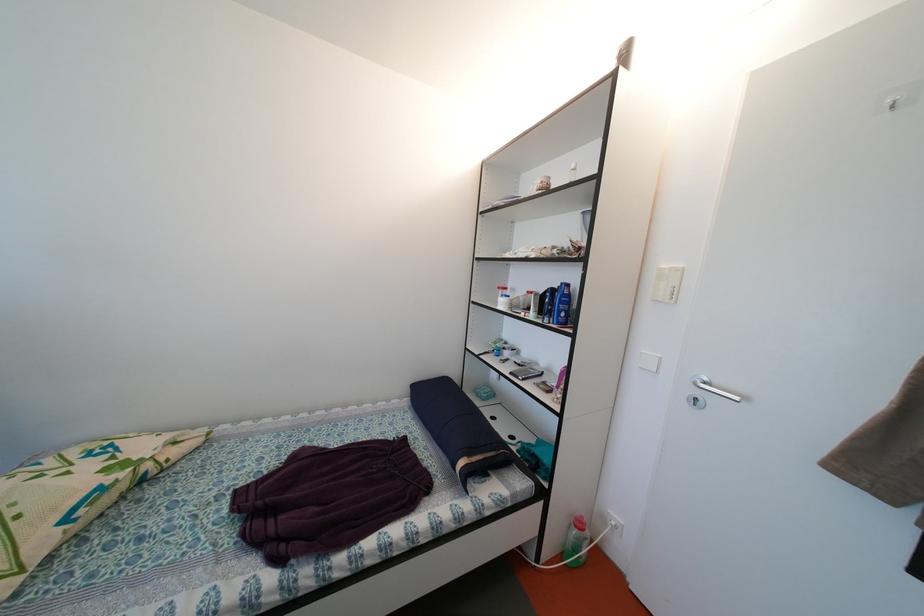
This screenshot has height=616, width=924. Describe the element at coordinates (562, 305) in the screenshot. I see `a blue lotion bottle` at that location.